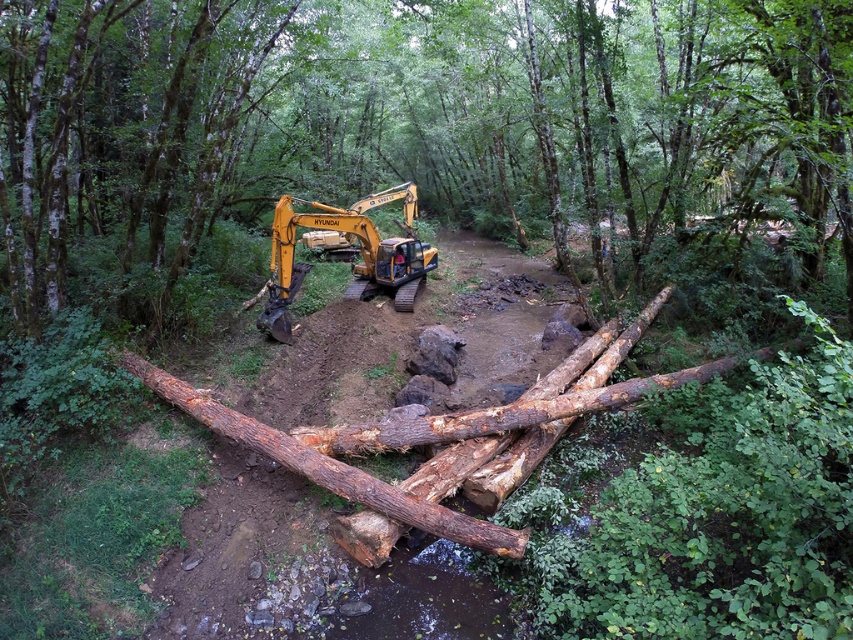
Question: Which of the following is the farthest from the observer?

Choices:
 (A) (242, 157)
 (B) (402, 280)

Answer: (A)

Question: From the image, what is the correct spatial relationship of rough wooden log at center in relation to yellow metallic excavator at center?

Choices:
 (A) below
 (B) above

Answer: (B)

Question: Which of the following is the closest to the observer?

Choices:
 (A) (387, 196)
 (B) (448, 154)

Answer: (A)

Question: Does rough wooden log at center come behind yellow metallic excavator at center?

Choices:
 (A) yes
 (B) no

Answer: (B)

Question: Can you confirm if rough wooden log at center is positioned below yellow metallic excavator at center?

Choices:
 (A) yes
 (B) no

Answer: (B)

Question: Which point is closer to the camera?

Choices:
 (A) rough wooden log at center
 (B) yellow metallic excavator at center

Answer: (A)